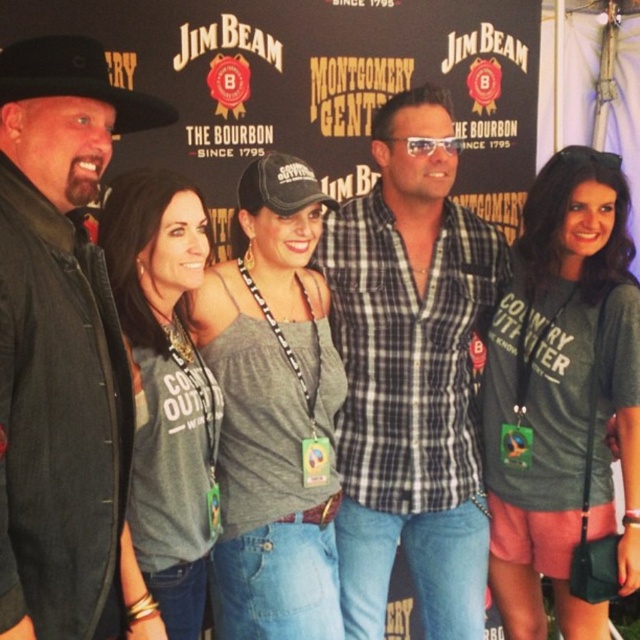
Question: Where is checkered fabric shirt at center located in relation to black felt cowboy hat at upper left in the image?

Choices:
 (A) above
 (B) below

Answer: (B)

Question: Does gray cotton tank top at center appear over gray fabric shirt at center?

Choices:
 (A) yes
 (B) no

Answer: (B)

Question: Can you confirm if gray cotton shirt at center is smaller than gray cotton tank top at center?

Choices:
 (A) no
 (B) yes

Answer: (A)

Question: Which point is farther to the camera?

Choices:
 (A) gray cotton shirt at center
 (B) checkered fabric shirt at center

Answer: (B)

Question: Which point is farther from the camera taking this photo?

Choices:
 (A) (499, 532)
 (B) (392, 138)
 (C) (435, 205)

Answer: (A)

Question: Which of the following is the farthest from the observer?

Choices:
 (A) gray cotton shirt at center
 (B) black leather jacket at left
 (C) clear plastic sunglasses at center
 (D) black felt cowboy hat at upper left

Answer: (C)